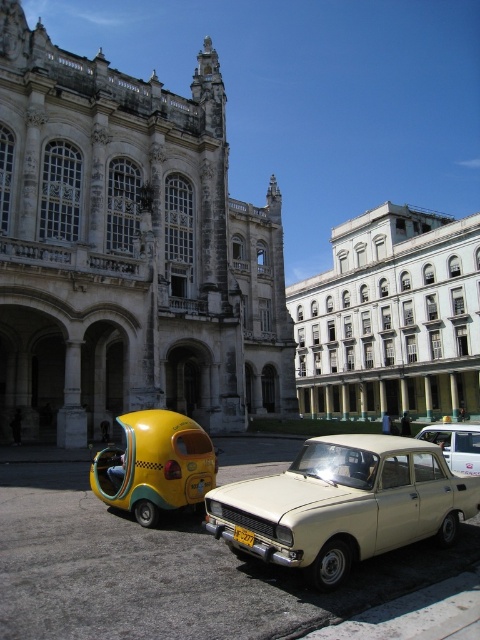
Does white stone building at left come in front of white glossy building at upper center?

That is True.

Does white stone building at left have a greater width compared to white glossy building at upper center?

In fact, white stone building at left might be narrower than white glossy building at upper center.

This screenshot has width=480, height=640. Describe the element at coordinates (129, 250) in the screenshot. I see `white stone building at left` at that location.

Locate an element on the screen. white stone building at left is located at coordinates (129, 250).

Which of these two, white glossy building at upper center or beige matte sedan at center, stands shorter?

beige matte sedan at center

Is white glossy building at upper center above beige matte sedan at center?

Correct, white glossy building at upper center is located above beige matte sedan at center.

Between point (440, 257) and point (322, 502), which one is positioned behind?

The point (440, 257) is more distant.

Where is `white glossy building at upper center`? The width and height of the screenshot is (480, 640). white glossy building at upper center is located at coordinates (392, 317).

Based on the photo, does yellow matte taxi at lower left have a smaller size compared to yellow plastic license plate at center?

Incorrect, yellow matte taxi at lower left is not smaller in size than yellow plastic license plate at center.

Does yellow matte taxi at lower left have a greater height compared to yellow plastic license plate at center?

Yes.

Between point (134, 444) and point (237, 532), which one is positioned behind?

Positioned behind is point (134, 444).

In order to click on yellow matte taxi at lower left in this screenshot , I will do `click(155, 465)`.